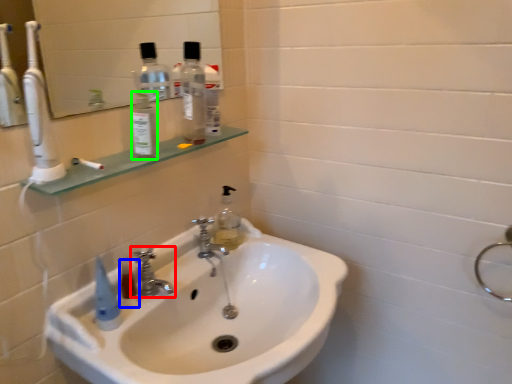
Question: Which object is the farthest from tap (highlighted by a red box)? Choose among these: mouthwash (highlighted by a blue box) or bottle (highlighted by a green box).

Choices:
 (A) mouthwash
 (B) bottle

Answer: (B)